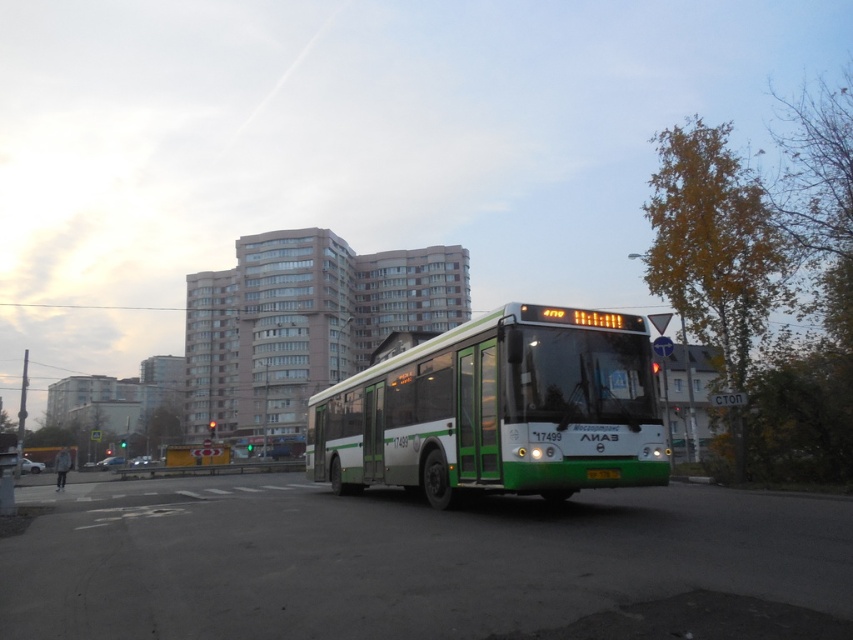
Is green matte bus at center below silver metallic car at lower left?

No.

Describe the element at coordinates (498, 410) in the screenshot. I see `green matte bus at center` at that location.

Where is `green matte bus at center`? This screenshot has width=853, height=640. green matte bus at center is located at coordinates (498, 410).

Which is below, metallic silver car at center or silver metallic car at lower left?

metallic silver car at center

What do you see at coordinates (109, 461) in the screenshot? The height and width of the screenshot is (640, 853). I see `metallic silver car at center` at bounding box center [109, 461].

Identify the location of metallic silver car at center. This screenshot has width=853, height=640. (109, 461).

The image size is (853, 640). I want to click on metallic silver car at center, so click(x=109, y=461).

How distant is green matte bus at center from metallic silver car at center?

green matte bus at center and metallic silver car at center are 198.13 feet apart from each other.

Can you confirm if green matte bus at center is taller than metallic silver car at center?

Yes.

Is point (483, 321) in front of point (103, 467)?

Yes, it is.

This screenshot has width=853, height=640. What are the coordinates of `green matte bus at center` in the screenshot? It's located at click(498, 410).